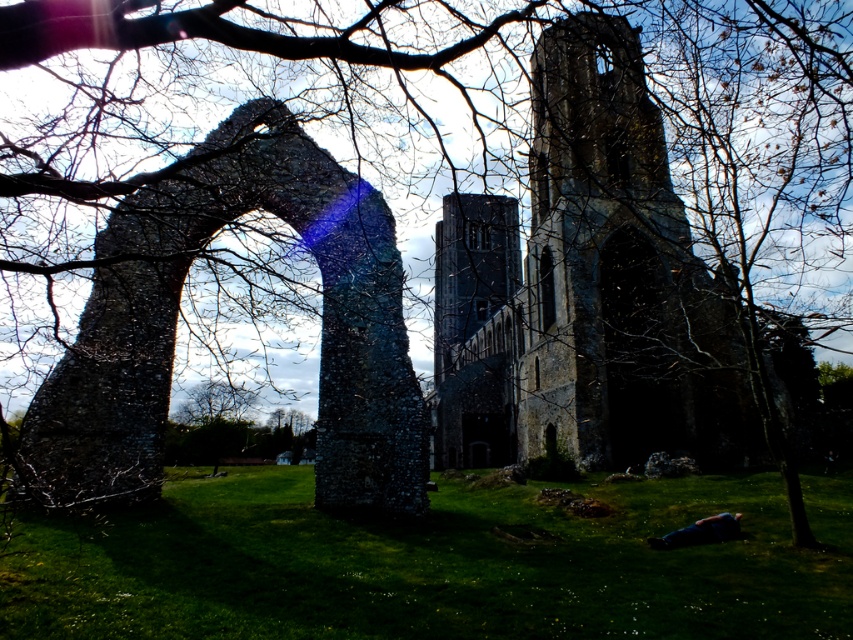
In the scene shown: You are standing at the camera position and want to take a photo of the rusty stone church at center. If your camera has a maximum focus range of 200 feet, will you be able to capture the church clearly?

The rusty stone church at center is 250.18 feet away from the camera, which exceeds the camera maximum focus range of 200 feet. Therefore, the camera cannot focus on the church clearly.

From the picture: You are a photographer planning to take a photo of the rusty stone church at center and the rustic stone arch at left. Given their height difference, which object should you focus on first to ensure both are in frame without needing to adjust your camera angle?

The rusty stone church at center is much taller than the rustic stone arch at left, so you should focus on the rusty stone church at center first to ensure its full height is captured in the frame while still including the rustic stone arch at left.